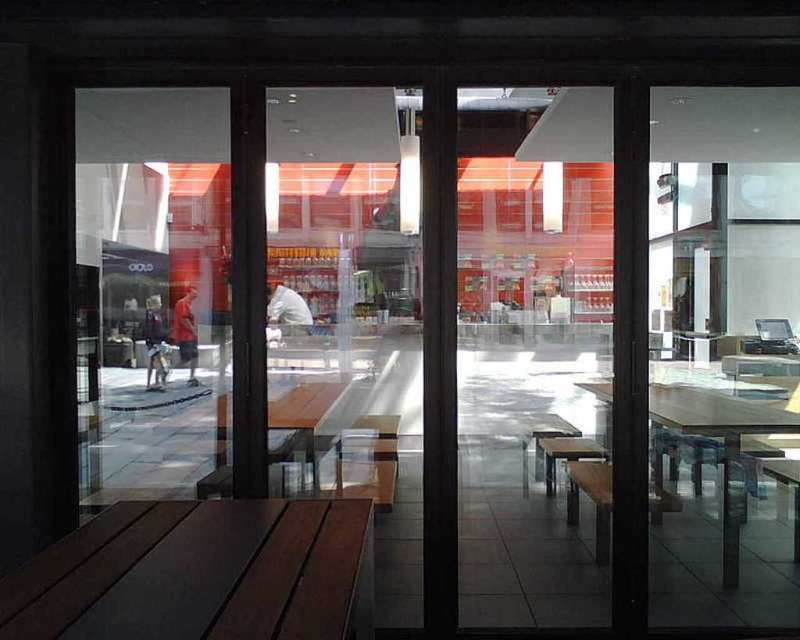
You are standing inside the building looking through the glass doors. There are two points marked on the glass doors at coordinates point (164, 636) and point (700, 388). Which point is nearer to you?

Point (164, 636) is closer to the viewer than point (700, 388).

You are standing inside a building and want to exit through the transparent glass screen door at center. There is a brown wood table at lower left in your way. Can you walk straight towards the door without moving the table?

The transparent glass screen door at center is further to the viewer than brown wood table at lower left, so the brown wood table at lower left is closer to you. Therefore, you would need to move the brown wood table at lower left out of the way to walk straight towards the transparent glass screen door at center.

You are standing inside the modern interior space and want to exit through the transparent glass screen door at center. Based on the coordinates provided in the description, can you determine if the door is positioned in the lower half or upper half of the image?

The transparent glass screen door at center is located at point coordinates with a y value of 0.667. Since the y coordinate ranges from 0 at the bottom to 1 at the top, a value of 0.667 means it is in the upper half of the image.